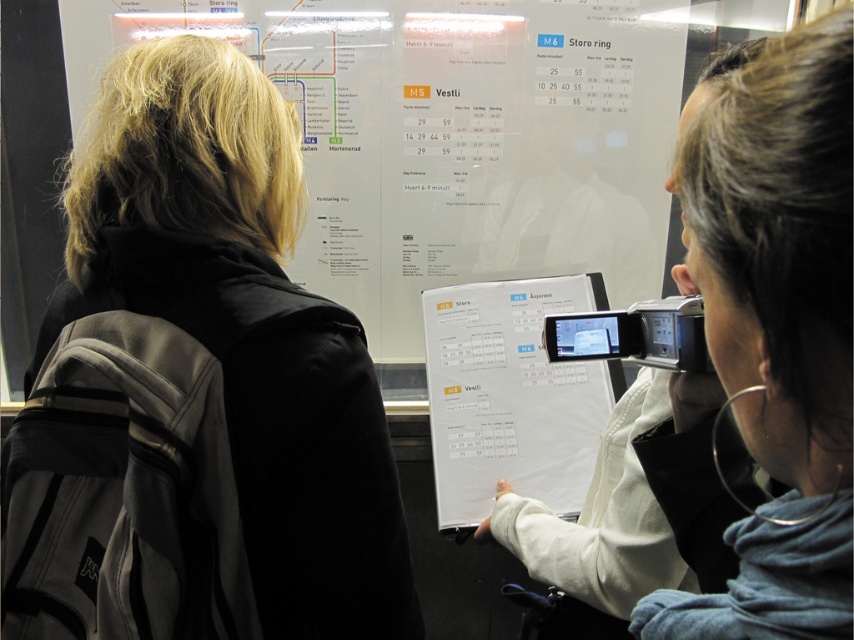
Between white paper at center and dark blue hoodie at upper right, which one is positioned higher?

white paper at center is above.

Can you confirm if white paper at center is positioned below dark blue hoodie at upper right?

Actually, white paper at center is above dark blue hoodie at upper right.

Identify the location of white paper at center. (447, 134).

Which is behind, point (330, 548) or point (471, 348)?

Point (471, 348)

Is black fabric jacket at upper left above white paper calendar at center?

Yes.

Is point (373, 374) closer to camera compared to point (609, 381)?

Yes.

I want to click on black fabric jacket at upper left, so click(319, 486).

Looking at this image, does dark blue hoodie at upper right appear under white paper calendar at center?

Incorrect, dark blue hoodie at upper right is not positioned below white paper calendar at center.

Does dark blue hoodie at upper right appear on the right side of white paper calendar at center?

Yes, dark blue hoodie at upper right is to the right of white paper calendar at center.

You are a GUI agent. You are given a task and a screenshot of the screen. Output one action in this format:
    pyautogui.click(x=<x>, y=<y>)
    Task: Click on the dark blue hoodie at upper right
    The width and height of the screenshot is (854, 640).
    Given the screenshot: What is the action you would take?
    pyautogui.click(x=771, y=342)